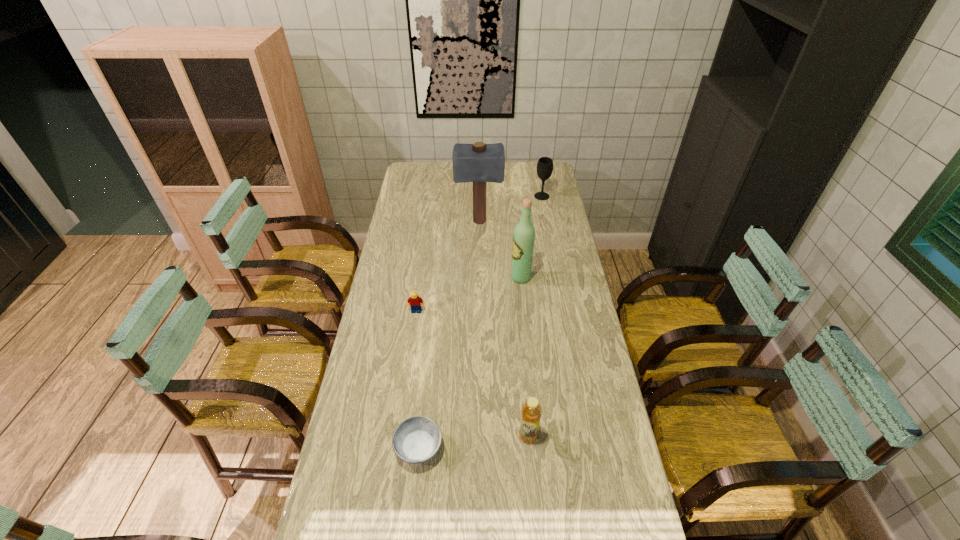
Where is `free space located on the front-facing side of the wine bottle`? The width and height of the screenshot is (960, 540). free space located on the front-facing side of the wine bottle is located at coordinates (442, 278).

This screenshot has width=960, height=540. I want to click on free space located on the front-facing side of the wine bottle, so click(478, 278).

Find the location of a particular element. Image resolution: width=960 pixels, height=540 pixels. free space located 0.070m on the back of the farthest object is located at coordinates (540, 185).

At what (x,y) coordinates should I click in order to perform the action: click on free region located 0.340m on the back of the bottle. Please return your answer as a coordinate pair (x, y). Image resolution: width=960 pixels, height=540 pixels. Looking at the image, I should click on (520, 337).

Identify the location of blank space located 0.380m on the front-facing side of the third nearest object. (403, 405).

Where is `vacant space situated 0.390m on the right of the ashtray`? This screenshot has width=960, height=540. vacant space situated 0.390m on the right of the ashtray is located at coordinates (580, 449).

Locate an element on the screen. The image size is (960, 540). Lego at the left edge is located at coordinates (416, 302).

I want to click on ashtray located at the left edge, so [x=415, y=440].

This screenshot has height=540, width=960. I want to click on object present at the right edge, so click(x=545, y=164).

In the image, there is a desktop. Where is `free region at the left edge`? This screenshot has width=960, height=540. free region at the left edge is located at coordinates (392, 232).